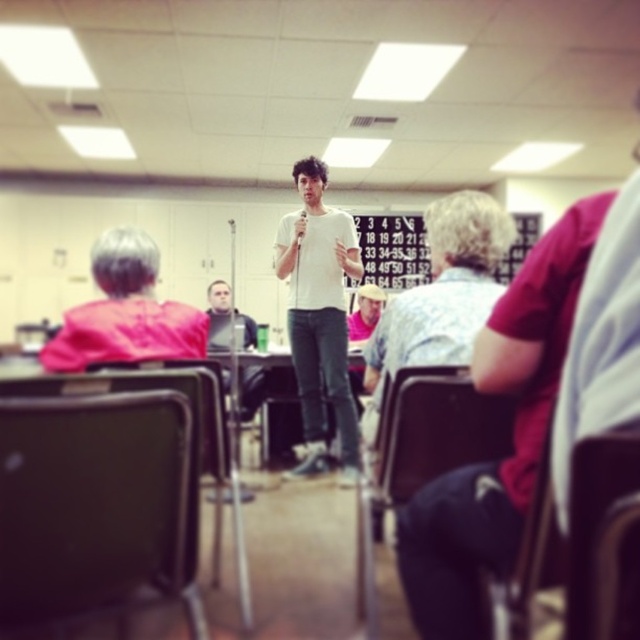
Can you confirm if pink fabric shirt at left is positioned below black plastic chair at lower left?

No, pink fabric shirt at left is not below black plastic chair at lower left.

Which is behind, point (125, 349) or point (204, 365)?

Positioned behind is point (204, 365).

What do you see at coordinates (125, 310) in the screenshot?
I see `pink fabric shirt at left` at bounding box center [125, 310].

The width and height of the screenshot is (640, 640). I want to click on pink fabric shirt at left, so click(x=125, y=310).

Can you confirm if black leather chair at lower left is bigger than light brown leather hat at center?

No.

Who is more forward, (0, 625) or (360, 308)?

Point (0, 625) is more forward.

The image size is (640, 640). What are the coordinates of `black leather chair at lower left` in the screenshot? It's located at tap(93, 506).

Is black leather chair at lower left positioned behind black plastic chair at lower left?

No, it is not.

Does black leather chair at lower left have a smaller size compared to black plastic chair at lower left?

Indeed, black leather chair at lower left has a smaller size compared to black plastic chair at lower left.

What do you see at coordinates (93, 506) in the screenshot?
I see `black leather chair at lower left` at bounding box center [93, 506].

I want to click on black leather chair at lower left, so click(x=93, y=506).